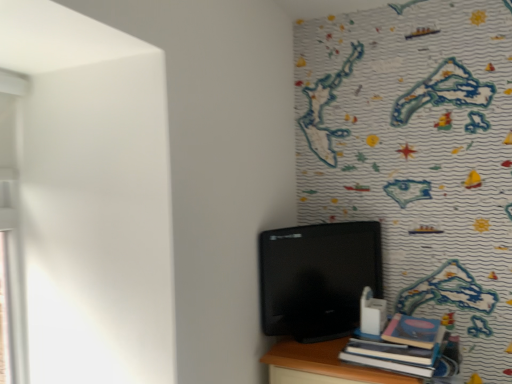
This screenshot has height=384, width=512. In order to click on black glossy monitor at center in this screenshot , I will do `click(317, 278)`.

Image resolution: width=512 pixels, height=384 pixels. What do you see at coordinates (317, 278) in the screenshot?
I see `black glossy monitor at center` at bounding box center [317, 278].

Measure the distance between point (270, 274) and camera.

The depth of point (270, 274) is 1.33 meters.

Locate an element on the screen. hardcover book at lower right is located at coordinates (402, 357).

Measure the distance between hardcover book at lower right and camera.

hardcover book at lower right is 1.07 meters from camera.

Describe the element at coordinates (402, 357) in the screenshot. I see `hardcover book at lower right` at that location.

I want to click on black glossy monitor at center, so click(317, 278).

Is black glossy monitor at center at the right side of hardcover book at lower right?

Incorrect, black glossy monitor at center is not on the right side of hardcover book at lower right.

Which is behind, black glossy monitor at center or hardcover book at lower right?

black glossy monitor at center.

Is point (339, 311) farther from camera compared to point (352, 338)?

Yes, point (339, 311) is behind point (352, 338).

From the image's perspective, is black glossy monitor at center above or below hardcover book at lower right?

From the image's perspective, black glossy monitor at center appears above hardcover book at lower right.

From a real-world perspective, does black glossy monitor at center stand above hardcover book at lower right?

Yes, from a real-world perspective, black glossy monitor at center is on top of hardcover book at lower right.

Does black glossy monitor at center have a greater width compared to hardcover book at lower right?

In fact, black glossy monitor at center might be narrower than hardcover book at lower right.

Is black glossy monitor at center shorter than hardcover book at lower right?

No, black glossy monitor at center is not shorter than hardcover book at lower right.

Does black glossy monitor at center have a smaller size compared to hardcover book at lower right?

Actually, black glossy monitor at center might be larger than hardcover book at lower right.

Looking at this image, can hardcover book at lower right be found inside black glossy monitor at center?

No, hardcover book at lower right is not inside black glossy monitor at center.

Is black glossy monitor at center next to hardcover book at lower right?

black glossy monitor at center and hardcover book at lower right are not in contact.

Could you tell me if black glossy monitor at center is facing hardcover book at lower right?

Yes, black glossy monitor at center is oriented towards hardcover book at lower right.

What's the angular difference between black glossy monitor at center and hardcover book at lower right's facing directions?

Answer: The facing directions of black glossy monitor at center and hardcover book at lower right are 56.6 degrees apart.

Find the location of a particular element. The image size is (512, 384). book below the black glossy monitor at center (from a real-world perspective) is located at coordinates (402, 357).

Does hardcover book at lower right appear on the left side of black glossy monitor at center?

No.

Based on the photo, relative to black glossy monitor at center, is hardcover book at lower right in front or behind?

In the image, hardcover book at lower right appears in front of black glossy monitor at center.

Which is in front, point (413, 373) or point (352, 229)?

The point (413, 373) is in front.

From the image's perspective, which object appears higher, hardcover book at lower right or black glossy monitor at center?

black glossy monitor at center.

From a real-world perspective, does hardcover book at lower right stand above black glossy monitor at center?

No, from a real-world perspective, hardcover book at lower right is not on top of black glossy monitor at center.

Considering the sizes of objects hardcover book at lower right and black glossy monitor at center in the image provided, who is thinner, hardcover book at lower right or black glossy monitor at center?

Thinner between the two is black glossy monitor at center.

Is hardcover book at lower right taller than black glossy monitor at center?

Incorrect, the height of hardcover book at lower right is not larger of that of black glossy monitor at center.

In the scene shown: Who is bigger, hardcover book at lower right or black glossy monitor at center?

black glossy monitor at center.

Is hardcover book at lower right inside or outside of black glossy monitor at center?

hardcover book at lower right is not inside black glossy monitor at center, it's outside.

Is hardcover book at lower right next to black glossy monitor at center and touching it?

No, hardcover book at lower right is not with black glossy monitor at center.

Could you tell me if hardcover book at lower right is facing black glossy monitor at center?

No, hardcover book at lower right is not turned towards black glossy monitor at center.

What's the angular difference between hardcover book at lower right and black glossy monitor at center's facing directions?

hardcover book at lower right and black glossy monitor at center are facing 56.6 degrees away from each other.

Locate an element on the screen. The image size is (512, 384). computer above the hardcover book at lower right (from a real-world perspective) is located at coordinates (317, 278).

Where is `book in front of the black glossy monitor at center`? book in front of the black glossy monitor at center is located at coordinates (402, 357).

This screenshot has height=384, width=512. I want to click on book that appears below the black glossy monitor at center (from the image's perspective), so click(x=402, y=357).